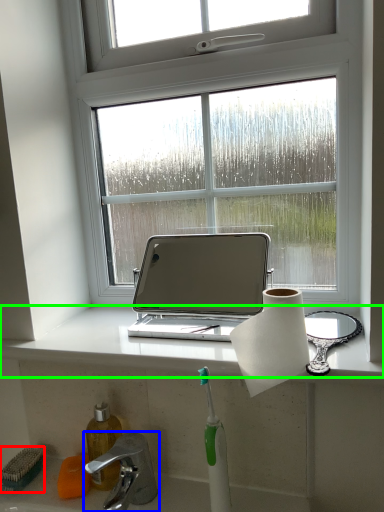
Question: Based on their relative distances, which object is farther from brush (highlighted by a red box)? Choose from tap (highlighted by a blue box) and window sill (highlighted by a green box).

Choices:
 (A) tap
 (B) window sill

Answer: (B)